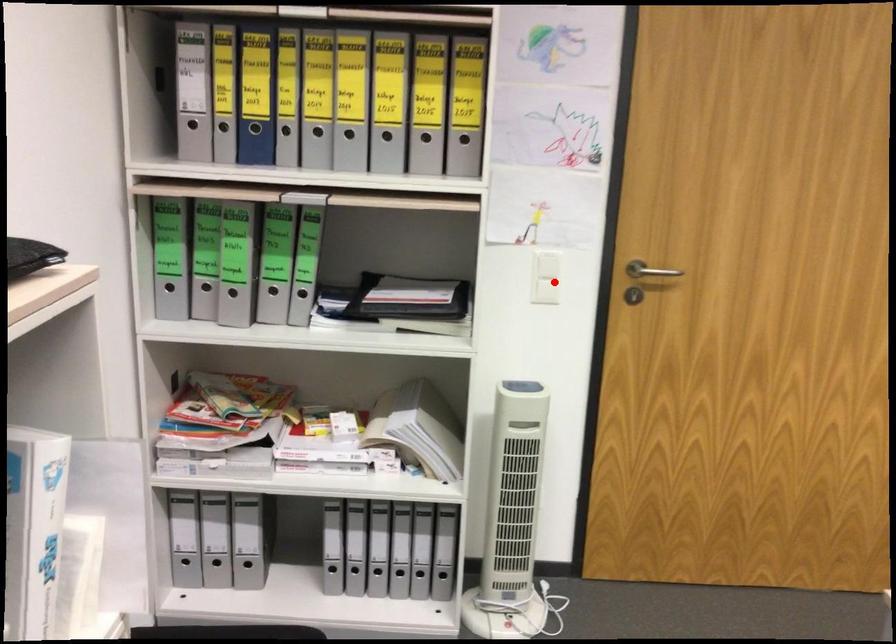
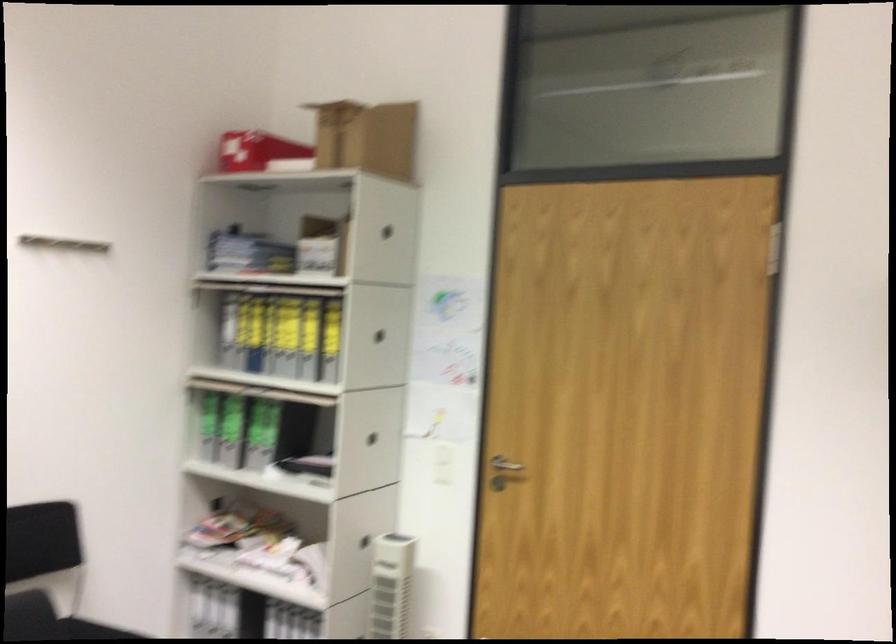
Question: A red point is marked in image1. In image2, is the corresponding 3D point closer to the camera or farther? Reply with the corresponding letter.

Choices:
 (A) The corresponding 3D point is closer.
 (B) The corresponding 3D point is farther.

Answer: (B)